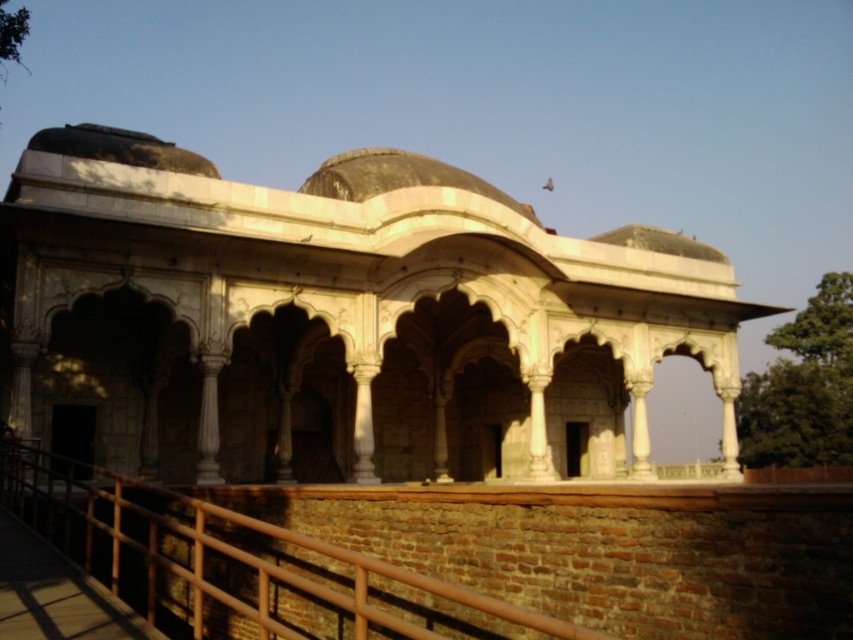
Where is `white marble palace at center`? white marble palace at center is located at coordinates 337,321.